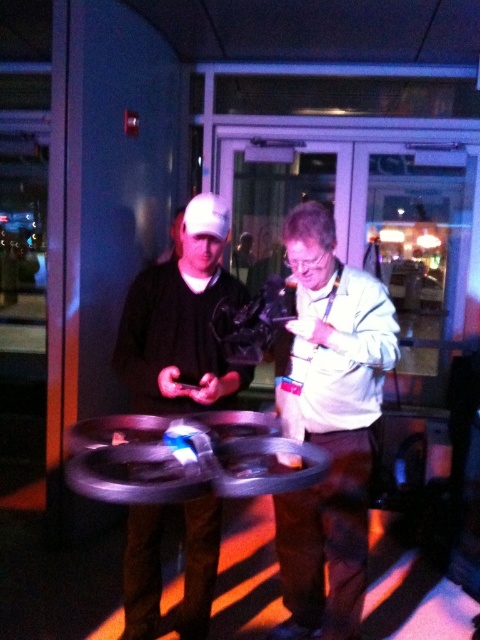
Does white matte jacket at center have a greater height compared to matte black phone at center?

Correct, white matte jacket at center is much taller as matte black phone at center.

Is white matte jacket at center to the left of matte black phone at center from the viewer's perspective?

In fact, white matte jacket at center is to the right of matte black phone at center.

Which is in front, point (295, 572) or point (201, 580)?

Point (201, 580)

Find the location of a particular element. The image size is (480, 640). white matte jacket at center is located at coordinates (331, 426).